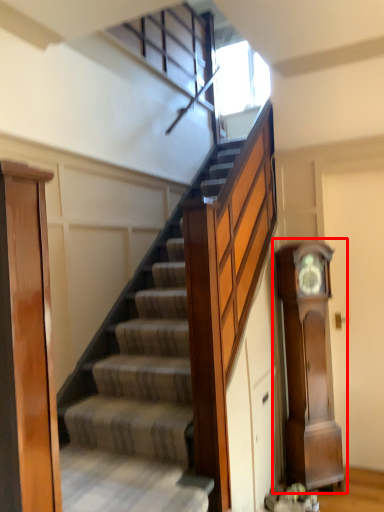
Question: Where is clock (annotated by the red box) located in relation to door in the image?

Choices:
 (A) left
 (B) right

Answer: (B)